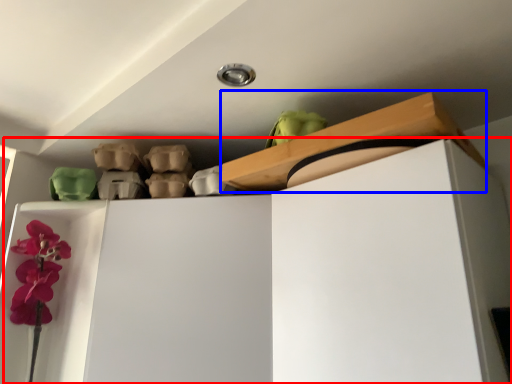
Question: Which object appears farthest to the camera in this image, dresser (highlighted by a red box) or shelf (highlighted by a blue box)?

Choices:
 (A) dresser
 (B) shelf

Answer: (B)